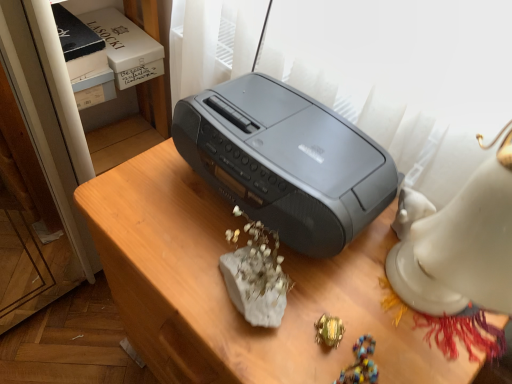
Where is `free space to the left of green metallic ring at lower center`? This screenshot has height=384, width=512. free space to the left of green metallic ring at lower center is located at coordinates (225, 297).